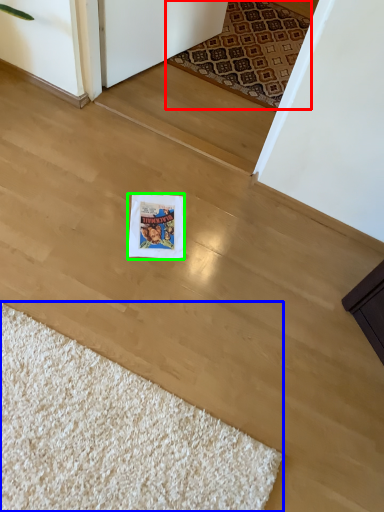
Question: Estimate the real-world distances between objects in this image. Which object is farther from mat (highlighted by a red box), doormat (highlighted by a blue box) or postcard (highlighted by a green box)?

Choices:
 (A) doormat
 (B) postcard

Answer: (A)